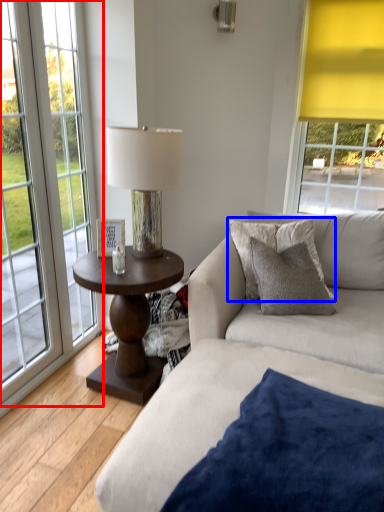
Question: Which point is further to the camera, window (highlighted by a red box) or pillow (highlighted by a blue box)?

Choices:
 (A) window
 (B) pillow

Answer: (B)